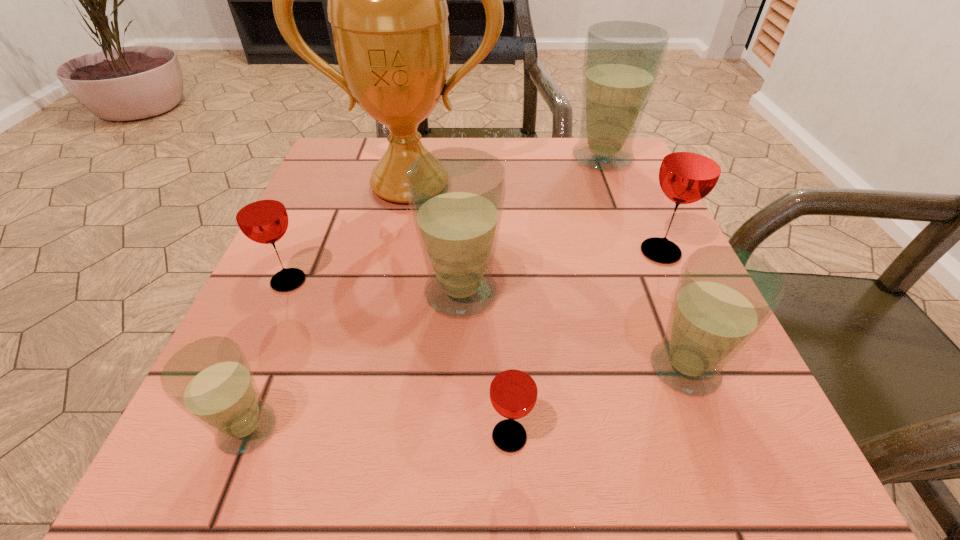
Identify the location of glass present at the far edge. (622, 59).

Locate an element on the screen. This screenshot has height=540, width=960. award present at the left edge is located at coordinates (386, 0).

Locate an element on the screen. object present at the far left corner is located at coordinates (386, 0).

You are a GUI agent. You are given a task and a screenshot of the screen. Output one action in this format:
    pyautogui.click(x=<x>, y=<y>)
    Task: Click on the object that is at the near left corner
    The height and width of the screenshot is (540, 960).
    Given the screenshot: What is the action you would take?
    pyautogui.click(x=210, y=379)

Image resolution: width=960 pixels, height=540 pixels. What are the coordinates of `object situated at the far right corner` in the screenshot? It's located at (622, 59).

In order to click on vacant space at the far edge in this screenshot , I will do 501,161.

Locate an element on the screen. vacant space at the near edge of the desktop is located at coordinates (431, 460).

The width and height of the screenshot is (960, 540). Find the location of `free spot at the left edge of the desktop`. free spot at the left edge of the desktop is located at coordinates (357, 244).

Find the location of a particular element. vacant space at the right edge of the desktop is located at coordinates (599, 210).

Identify the location of vacant space at the far left corner of the desktop. The image size is (960, 540). (345, 137).